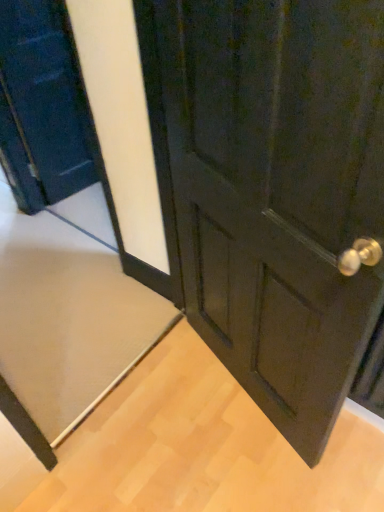
Question: Is matte black door at left, placed as the first door when sorted from left to right, far from beige carpet at lower left?

Choices:
 (A) no
 (B) yes

Answer: (A)

Question: Does matte black door at left, which appears as the 2th door when viewed from the right, have a lesser height compared to beige carpet at lower left?

Choices:
 (A) yes
 (B) no

Answer: (B)

Question: Is matte black door at left, placed as the first door when sorted from left to right, not inside beige carpet at lower left?

Choices:
 (A) no
 (B) yes

Answer: (B)

Question: Is the position of matte black door at left, which appears as the 2th door when viewed from the right, less distant than that of beige carpet at lower left?

Choices:
 (A) yes
 (B) no

Answer: (A)

Question: From a real-world perspective, does matte black door at left, placed as the first door when sorted from left to right, sit lower than beige carpet at lower left?

Choices:
 (A) yes
 (B) no

Answer: (B)

Question: Is matte black door at left, which appears as the 2th door when viewed from the right, taller than beige carpet at lower left?

Choices:
 (A) no
 (B) yes

Answer: (B)

Question: Can you confirm if matte black door at left, placed as the first door when sorted from left to right, is shorter than matte black door at center, positioned as the 1th door in right-to-left order?

Choices:
 (A) no
 (B) yes

Answer: (B)

Question: From the image's perspective, does matte black door at left, which appears as the 2th door when viewed from the right, appear higher than matte black door at center, positioned as the 1th door in right-to-left order?

Choices:
 (A) yes
 (B) no

Answer: (A)

Question: Can we say matte black door at left, which appears as the 2th door when viewed from the right, lies outside matte black door at center, the 2th door viewed from the left?

Choices:
 (A) yes
 (B) no

Answer: (A)

Question: Is matte black door at left, placed as the first door when sorted from left to right, in front of matte black door at center, the 2th door viewed from the left?

Choices:
 (A) no
 (B) yes

Answer: (A)

Question: Is matte black door at left, placed as the first door when sorted from left to right, bigger than matte black door at center, the 2th door viewed from the left?

Choices:
 (A) yes
 (B) no

Answer: (B)

Question: Does matte black door at left, which appears as the 2th door when viewed from the right, have a greater width compared to matte black door at center, the 2th door viewed from the left?

Choices:
 (A) no
 (B) yes

Answer: (A)

Question: Is matte black door at center, positioned as the 1th door in right-to-left order, facing away from matte black door at left, placed as the first door when sorted from left to right?

Choices:
 (A) yes
 (B) no

Answer: (B)